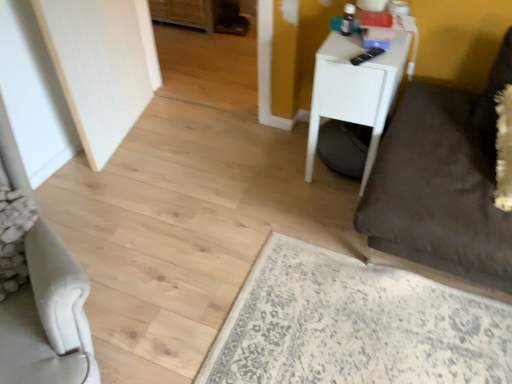
Locate an element on the screen. This screenshot has height=384, width=512. free space in front of white glossy table at upper right is located at coordinates (323, 222).